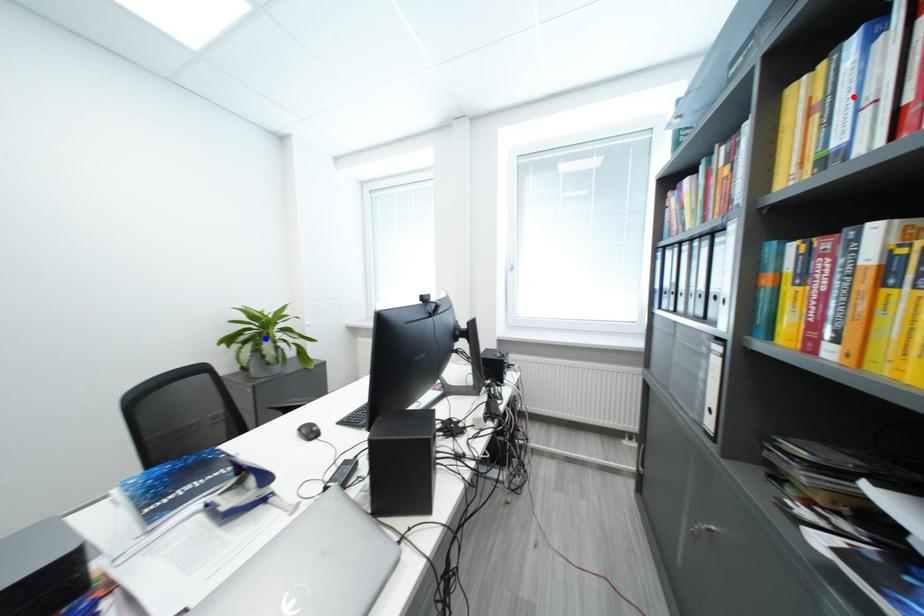
Question: In the image, two points are highlighted. Which point is nearer to the camera? Reply with the corresponding letter.

Choices:
 (A) blue point
 (B) red point

Answer: (B)